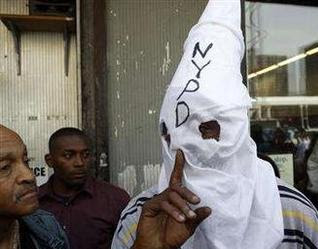
Locate an element on the screen. Image resolution: width=318 pixels, height=249 pixels. shelf is located at coordinates (36, 18).